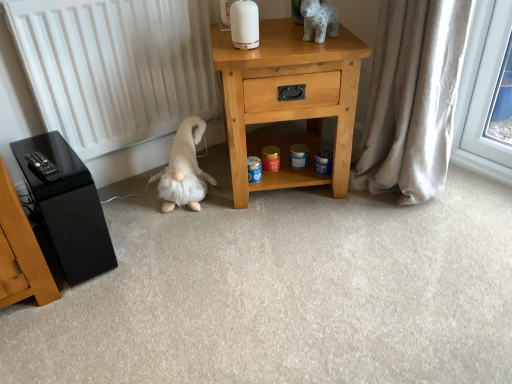
At what (x,y) coordinates should I click in order to perform the action: click on vacant space underneath fluffy white plush at lower left, which ranks as the 1th animal in bottom-to-top order (from a real-world perspective). Please return your answer as a coordinate pair (x, y). Image resolution: width=512 pixels, height=384 pixels. Looking at the image, I should click on (187, 204).